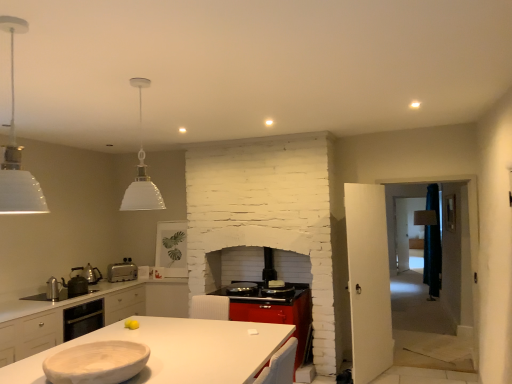
Question: From a real-world perspective, is white glass pendant lamp at upper center, the 2th light fixture viewed from the front, positioned above or below white matte countertop at center?

Choices:
 (A) below
 (B) above

Answer: (B)

Question: From the image's perspective, is white glass pendant lamp at upper center, the 2th light fixture viewed from the front, located above or below white matte countertop at center?

Choices:
 (A) above
 (B) below

Answer: (A)

Question: Considering the real-world distances, which object is closest to the white matte countertop at center?

Choices:
 (A) matte black kettle at left, which appears as the second appliance when viewed from the front
 (B) metallic silver kettle at left, the 3th appliance from the back
 (C) silver metallic toaster at lower left
 (D) white matte pendant light at upper left, the first light fixture positioned from the front
 (E) white glass pendant lamp at upper center, which is the 1th light fixture from back to front

Answer: (D)

Question: Which object is the farthest from the matte silver kettle at left, which is the 3th appliance from front to back?

Choices:
 (A) metallic silver kettle at left, the 3th appliance from the back
 (B) white matte countertop at center
 (C) white matte bowl at lower left
 (D) matte black kettle at left, the second appliance positioned from the back
 (E) white glass pendant lamp at upper center, which is the 1th light fixture from back to front

Answer: (C)